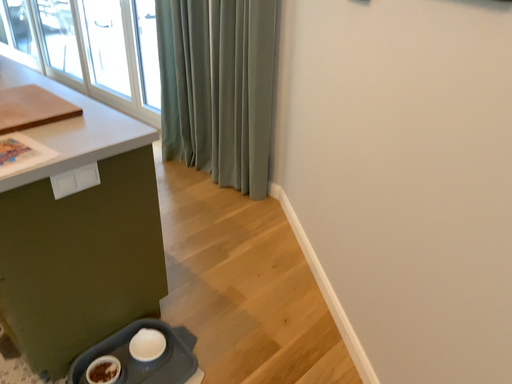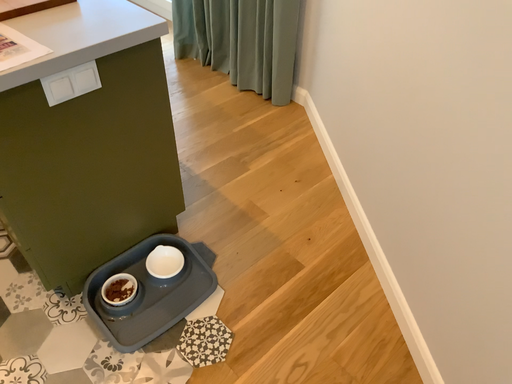
Question: How did the camera likely rotate when shooting the video?

Choices:
 (A) rotated upward
 (B) rotated downward

Answer: (B)